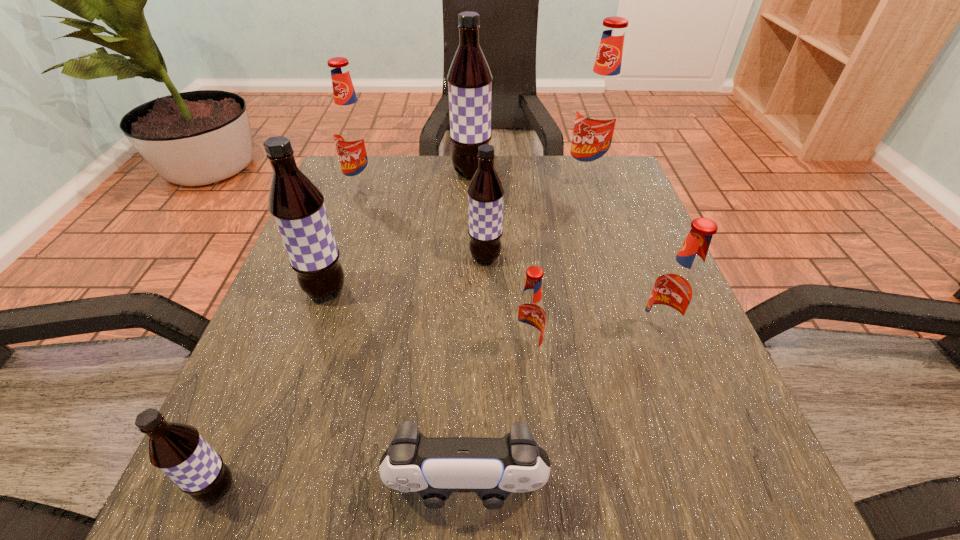
Locate an element on the screen. the nearest root beer is located at coordinates (177, 449).

Identify the location of the smallest brown root beer. coord(177,449).

The width and height of the screenshot is (960, 540). Identify the location of the shortest object. (493, 468).

Find the location of a particular element. This screenshot has height=540, width=960. vacant space situated on the right of the biggest brown root beer is located at coordinates [x=613, y=173].

You are a GUI agent. You are given a task and a screenshot of the screen. Output one action in this format:
    pyautogui.click(x=<x>, y=<y>)
    Task: Click on the free location located 0.050m on the left of the biggest red root beer
    The width and height of the screenshot is (960, 540).
    Given the screenshot: What is the action you would take?
    coord(546,179)

Find the location of a particular element. free space located 0.270m on the right of the leftmost red root beer is located at coordinates (493, 190).

This screenshot has width=960, height=540. Find the location of `free space located 0.050m on the front of the third smallest brown root beer`. free space located 0.050m on the front of the third smallest brown root beer is located at coordinates (x=313, y=329).

This screenshot has width=960, height=540. Find the location of `free space located on the back of the third biggest red root beer`. free space located on the back of the third biggest red root beer is located at coordinates (622, 242).

Locate an element on the screen. free space located 0.060m on the left of the second smallest brown root beer is located at coordinates (439, 257).

Identify the location of vacant area situated 0.380m on the back of the third root beer from right to left. This screenshot has height=540, width=960. (513, 207).